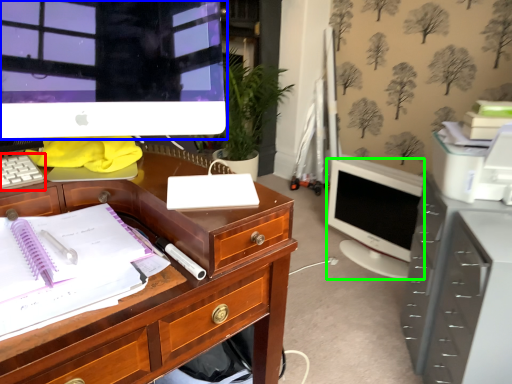
Question: Considering the real-world distances, which object is closest to computer keyboard (highlighted by a red box)? computer monitor (highlighted by a blue box) or computer monitor (highlighted by a green box).

Choices:
 (A) computer monitor
 (B) computer monitor

Answer: (A)